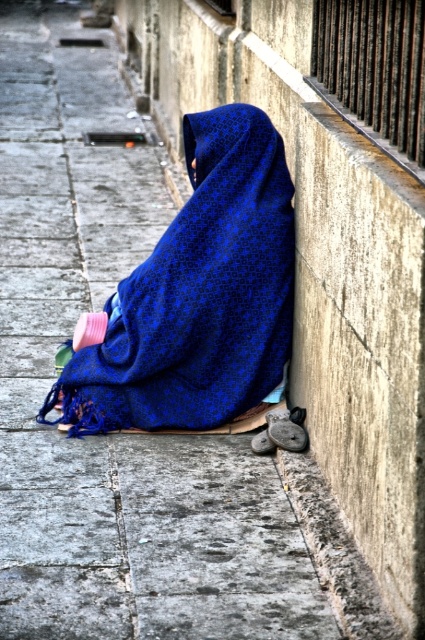
Between blue woven blanket at lower center and gray concrete curb at lower right, which one appears on the left side from the viewer's perspective?

blue woven blanket at lower center is more to the left.

Who is more forward, (246, 396) or (370, 580)?

Positioned in front is point (370, 580).

This screenshot has height=640, width=425. Identify the location of blue woven blanket at lower center. (197, 300).